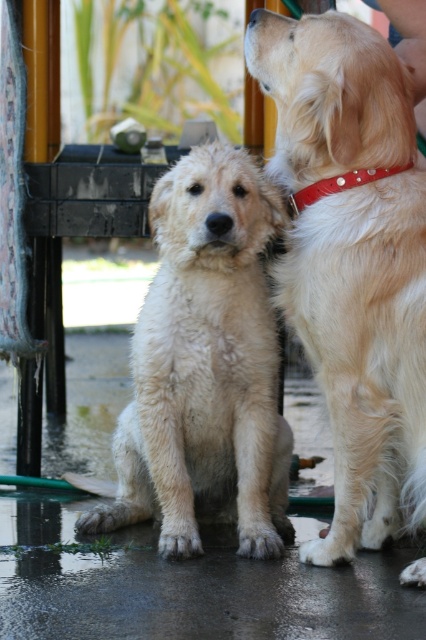
Between point (400, 428) and point (232, 499), which one is positioned in front?

Point (400, 428)

Does shiny golden fur at right have a smaller size compared to fuzzy white dog at center?

Indeed, shiny golden fur at right has a smaller size compared to fuzzy white dog at center.

This screenshot has width=426, height=640. Find the location of `shiny golden fur at right`. shiny golden fur at right is located at coordinates (365, 349).

In the scene shown: Which of these two, fuzzy white dog at center or red leather collar at upper right, stands shorter?

Standing shorter between the two is red leather collar at upper right.

Is fuzzy white dog at center bigger than red leather collar at upper right?

Yes, fuzzy white dog at center is bigger than red leather collar at upper right.

Who is more forward, (161, 186) or (339, 182)?

Point (339, 182) is in front.

In order to click on fuzzy white dog at center in this screenshot , I will do `click(206, 365)`.

Between point (342, 220) and point (347, 172), which one is positioned in front?

Positioned in front is point (342, 220).

Who is more distant from viewer, (x=379, y=492) or (x=380, y=168)?

The point (x=379, y=492) is behind.

Locate an element on the screen. This screenshot has width=426, height=640. shiny golden fur at right is located at coordinates (365, 349).

Find the location of a particular element. Image resolution: width=426 pixels, height=640 pixels. shiny golden fur at right is located at coordinates (365, 349).